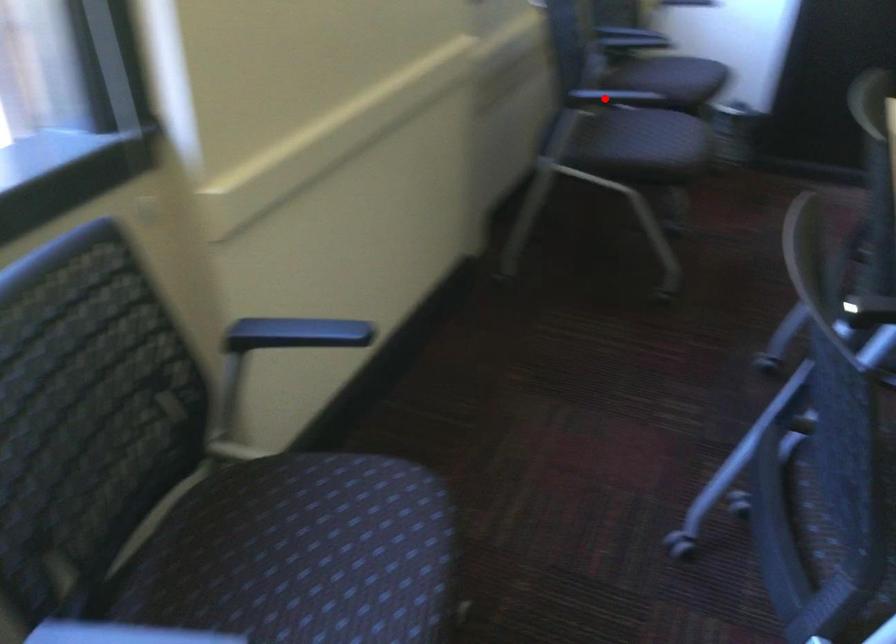
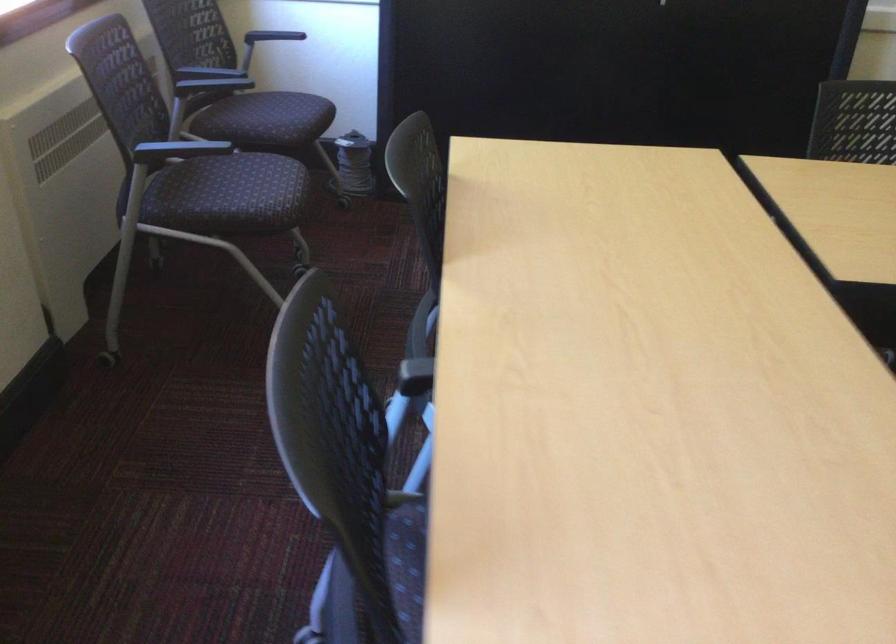
The point at the highlighted location is marked in the first image. Where is the corresponding point in the second image?

(176, 149)